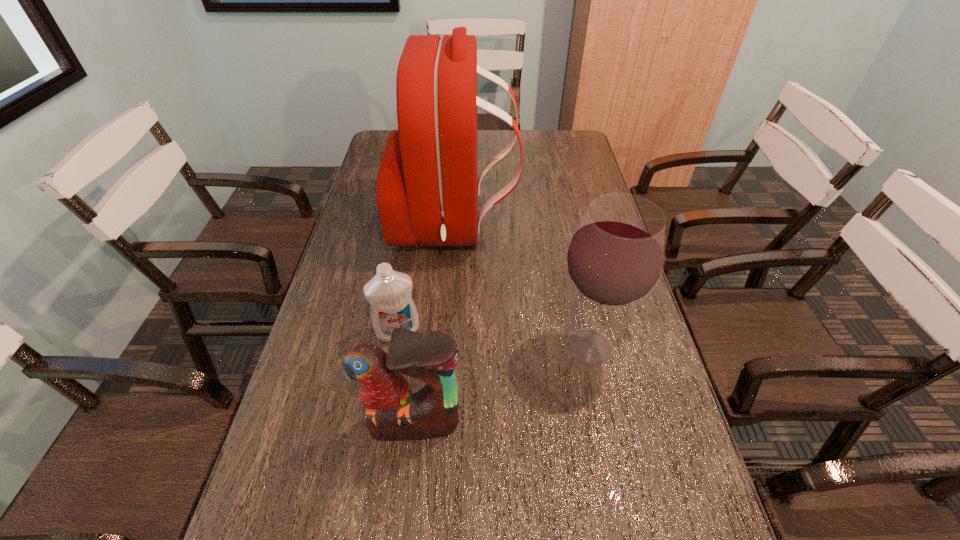
Where is `vacant space that's between the parrot and the backpack`? This screenshot has height=540, width=960. vacant space that's between the parrot and the backpack is located at coordinates (434, 324).

Image resolution: width=960 pixels, height=540 pixels. In order to click on free area in between the alcohol and the shortest object in this screenshot , I will do `click(493, 339)`.

In order to click on vacant space that is in between the second tallest object and the nearest object in this screenshot , I will do `click(501, 385)`.

This screenshot has width=960, height=540. Identify the location of free space between the nearest object and the shortest object. (406, 377).

The height and width of the screenshot is (540, 960). What are the coordinates of `unoccupied position between the detergent and the nearest object` in the screenshot? It's located at (406, 377).

At what (x,y) coordinates should I click in order to perform the action: click on vacant region between the tallest object and the nearest object. Please return your answer as a coordinate pair (x, y). The height and width of the screenshot is (540, 960). Looking at the image, I should click on (434, 324).

Find the location of a particular element. This screenshot has width=960, height=540. the third closest object to the shortest object is located at coordinates (615, 258).

You are a GUI agent. You are given a task and a screenshot of the screen. Output one action in this format:
    pyautogui.click(x=<x>, y=<y>)
    Task: Click on the object that stands as the third closest to the rightmost object
    The image size is (960, 540).
    Given the screenshot: What is the action you would take?
    pyautogui.click(x=389, y=292)

Where is `blank space that satisfies the following two spatial constraints: 1. on the strap side of the backpack; 2. on the front side of the detergent`? blank space that satisfies the following two spatial constraints: 1. on the strap side of the backpack; 2. on the front side of the detergent is located at coordinates (447, 331).

Identify the location of vacant space that satisfies the following two spatial constraints: 1. on the strap side of the tallest object; 2. on the right side of the second tallest object. (446, 347).